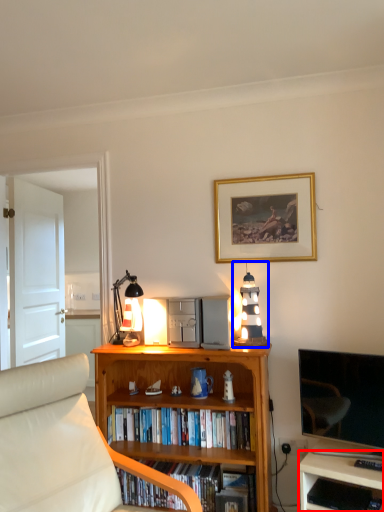
Question: Among these objects, which one is nearest to the camera, desk (highlighted by a red box) or lamp (highlighted by a blue box)?

Choices:
 (A) desk
 (B) lamp

Answer: (A)